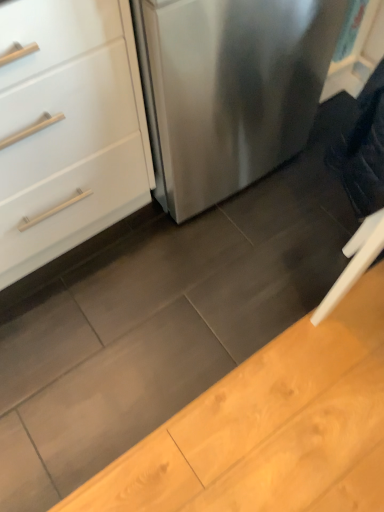
Where is `stainless steel refrigerator at left`? This screenshot has width=384, height=512. stainless steel refrigerator at left is located at coordinates (229, 90).

Describe the element at coordinates (229, 90) in the screenshot. I see `stainless steel refrigerator at left` at that location.

What is the approximate width of stainless steel refrigerator at left?

stainless steel refrigerator at left is 71.31 centimeters in width.

This screenshot has height=512, width=384. In order to click on stainless steel refrigerator at left in this screenshot , I will do `click(229, 90)`.